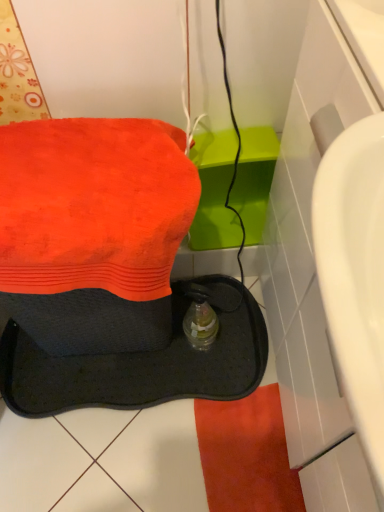
Question: Should I look upward or downward to see orange terry towel at upper left?

Choices:
 (A) down
 (B) up

Answer: (B)

Question: Is the depth of translucent plastic bottle at center greater than that of black rubber sink at lower left?

Choices:
 (A) yes
 (B) no

Answer: (A)

Question: From the image's perspective, is translucent plastic bottle at center located beneath black rubber sink at lower left?

Choices:
 (A) no
 (B) yes

Answer: (B)

Question: Does translucent plastic bottle at center have a smaller size compared to black rubber sink at lower left?

Choices:
 (A) yes
 (B) no

Answer: (A)

Question: Is translucent plastic bottle at center positioned beyond the bounds of black rubber sink at lower left?

Choices:
 (A) yes
 (B) no

Answer: (B)

Question: Is translucent plastic bottle at center positioned far away from black rubber sink at lower left?

Choices:
 (A) yes
 (B) no

Answer: (B)

Question: Does translucent plastic bottle at center turn towards black rubber sink at lower left?

Choices:
 (A) no
 (B) yes

Answer: (B)

Question: Is orange terry towel at upper left thinner than black rubber sink at lower left?

Choices:
 (A) no
 (B) yes

Answer: (B)

Question: Is orange terry towel at upper left bigger than black rubber sink at lower left?

Choices:
 (A) no
 (B) yes

Answer: (A)

Question: Is orange terry towel at upper left located outside black rubber sink at lower left?

Choices:
 (A) yes
 (B) no

Answer: (B)

Question: Does orange terry towel at upper left have a greater height compared to black rubber sink at lower left?

Choices:
 (A) no
 (B) yes

Answer: (A)

Question: Would you consider orange terry towel at upper left to be distant from black rubber sink at lower left?

Choices:
 (A) yes
 (B) no

Answer: (B)

Question: Can you confirm if orange terry towel at upper left is positioned to the right of black rubber sink at lower left?

Choices:
 (A) no
 (B) yes

Answer: (B)

Question: From a real-world perspective, is orange terry towel at upper left on top of translucent plastic bottle at center?

Choices:
 (A) no
 (B) yes

Answer: (B)